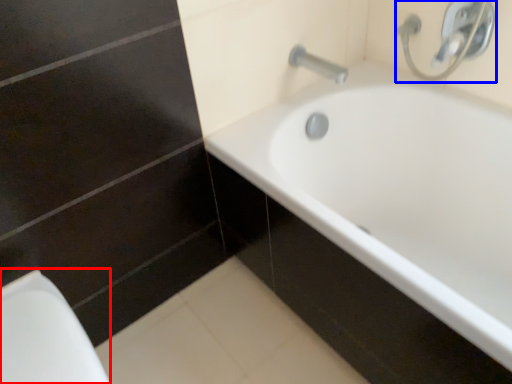
Question: Which point is closer to the camera, porcelain (highlighted by a red box) or plumbing fixture (highlighted by a blue box)?

Choices:
 (A) porcelain
 (B) plumbing fixture

Answer: (A)